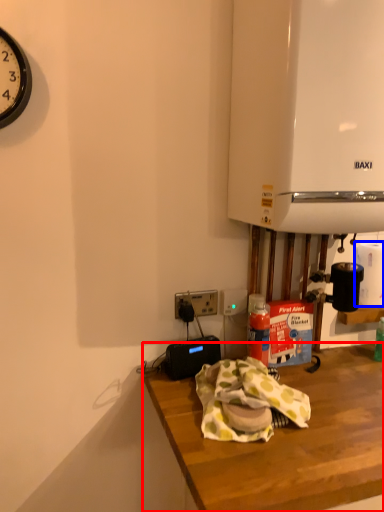
Question: Which point is closer to the camera, desk (highlighted by a red box) or paper towel (highlighted by a blue box)?

Choices:
 (A) desk
 (B) paper towel

Answer: (A)